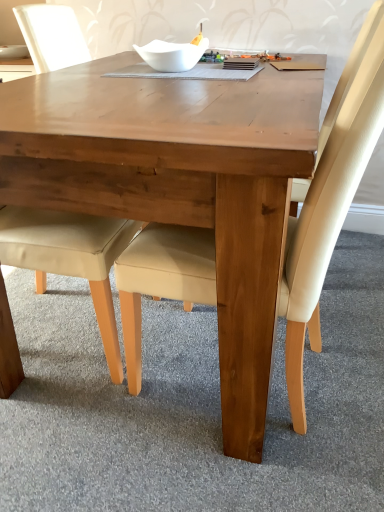
Question: From a real-world perspective, is wooden table at center under white glossy bowl at upper center?

Choices:
 (A) no
 (B) yes

Answer: (B)

Question: Does wooden table at center have a lesser width compared to white glossy bowl at upper center?

Choices:
 (A) yes
 (B) no

Answer: (B)

Question: Could you tell me if wooden table at center is turned towards white glossy bowl at upper center?

Choices:
 (A) yes
 (B) no

Answer: (B)

Question: Are wooden table at center and white glossy bowl at upper center making contact?

Choices:
 (A) yes
 (B) no

Answer: (B)

Question: Is wooden table at center wider than white glossy bowl at upper center?

Choices:
 (A) yes
 (B) no

Answer: (A)

Question: Is beige leather chair at lower left, which is the 2th chair from right to left, inside the boundaries of white glossy bowl at upper center, or outside?

Choices:
 (A) inside
 (B) outside

Answer: (B)

Question: Based on their sizes in the image, would you say beige leather chair at lower left, the first chair positioned from the left, is bigger or smaller than white glossy bowl at upper center?

Choices:
 (A) small
 (B) big

Answer: (B)

Question: From the image's perspective, relative to white glossy bowl at upper center, is beige leather chair at lower left, the first chair positioned from the left, above or below?

Choices:
 (A) above
 (B) below

Answer: (B)

Question: Considering their positions, is beige leather chair at lower left, the first chair positioned from the left, located in front of or behind white glossy bowl at upper center?

Choices:
 (A) behind
 (B) front

Answer: (B)

Question: Does point [148, 65] appear closer or farther from the camera than point [18, 52]?

Choices:
 (A) closer
 (B) farther

Answer: (A)

Question: Considering the positions of white glossy bowl at upper center and white glossy bowl at upper center in the image, is white glossy bowl at upper center wider or thinner than white glossy bowl at upper center?

Choices:
 (A) thin
 (B) wide

Answer: (A)

Question: Is white glossy bowl at upper center taller or shorter than white glossy bowl at upper center?

Choices:
 (A) tall
 (B) short

Answer: (A)

Question: From the image's perspective, is white glossy bowl at upper center above or below white glossy bowl at upper center?

Choices:
 (A) above
 (B) below

Answer: (B)

Question: Considering their positions, is white glossy bowl at upper center located in front of or behind beige leather chair at lower left, which is the 2th chair from right to left?

Choices:
 (A) front
 (B) behind

Answer: (B)

Question: Which is correct: white glossy bowl at upper center is inside beige leather chair at lower left, the first chair positioned from the left, or outside of it?

Choices:
 (A) inside
 (B) outside

Answer: (B)